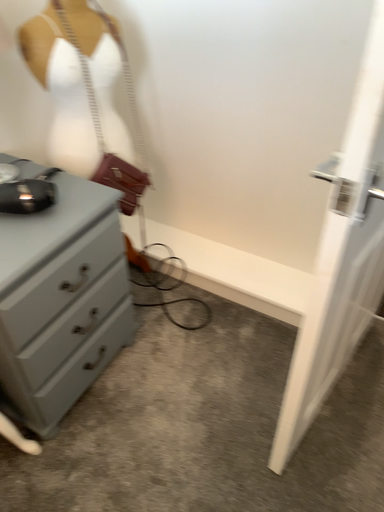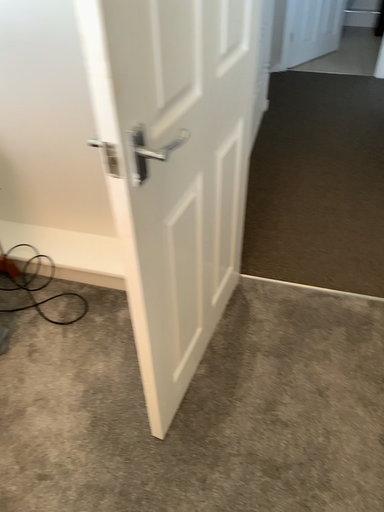
Question: How did the camera likely rotate when shooting the video?

Choices:
 (A) rotated right
 (B) rotated left

Answer: (A)